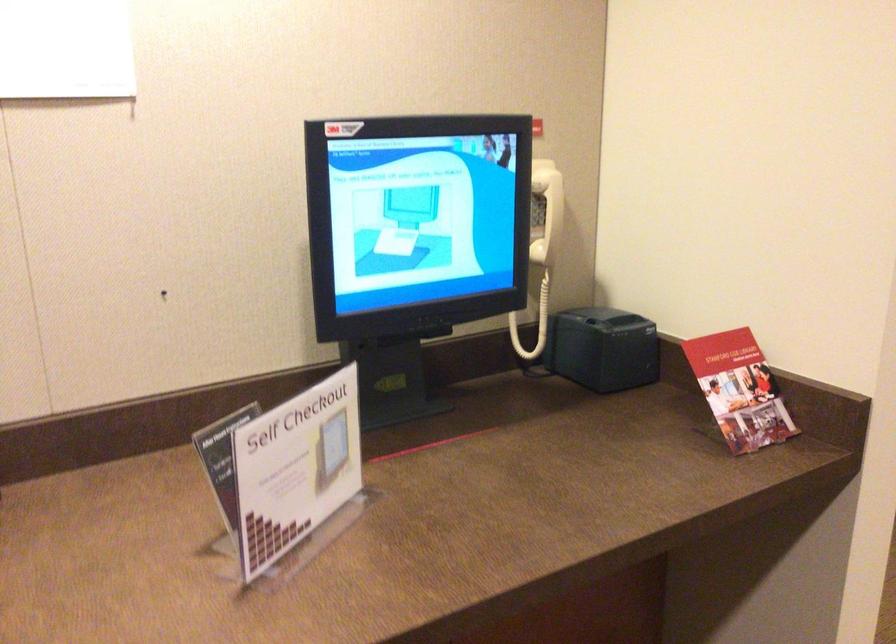
Find where to lift the red folded brochure. Please return your answer as a coordinate pair (x, y).

(739, 390)